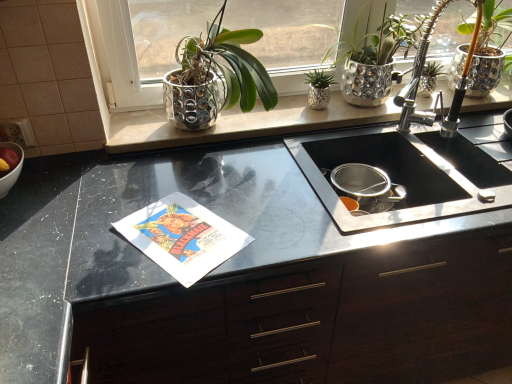
The height and width of the screenshot is (384, 512). What are the coordinates of `vacant space in shiny metallic pot at upper center, which is the 3th houseplant in right-to-left order (from a real-world perspective)` in the screenshot? It's located at (226, 128).